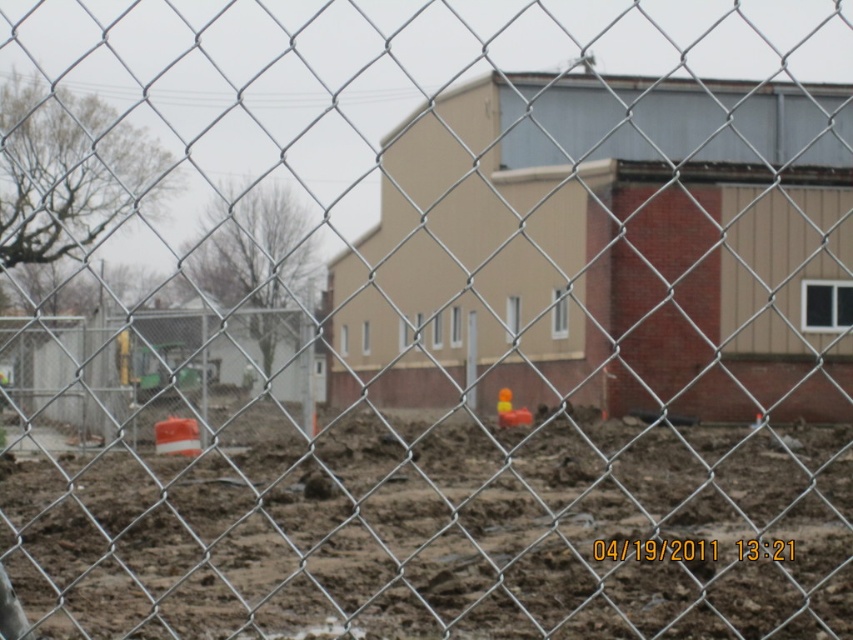
You are a delivery driver who needs to park your truck on the brown dirt at center near the beige brick building at center. Can you safely park there given the terrain?

The brown dirt at center is positioned under beige brick building at center, which suggests it might be an unstable or uneven area due to construction. Parking the truck there could be unsafe because of the muddy and uneven ground described in the scene.

You are a construction worker who needs to determine the material thickness for the foundation. You observe the brown dirt at center and the beige brick building at center in the image. Which material is thinner?

The brown dirt at center is thinner than the beige brick building at center according to the description.

You are a surveyor standing at the camera position looking at the construction site. You need to determine which of the two points, point (283, 593) or point (770, 99), is closer to you. Which point is closer?

Point (283, 593) is closer to the camera than point (770, 99), so the surveyor should choose point (283, 593) as the closer one.